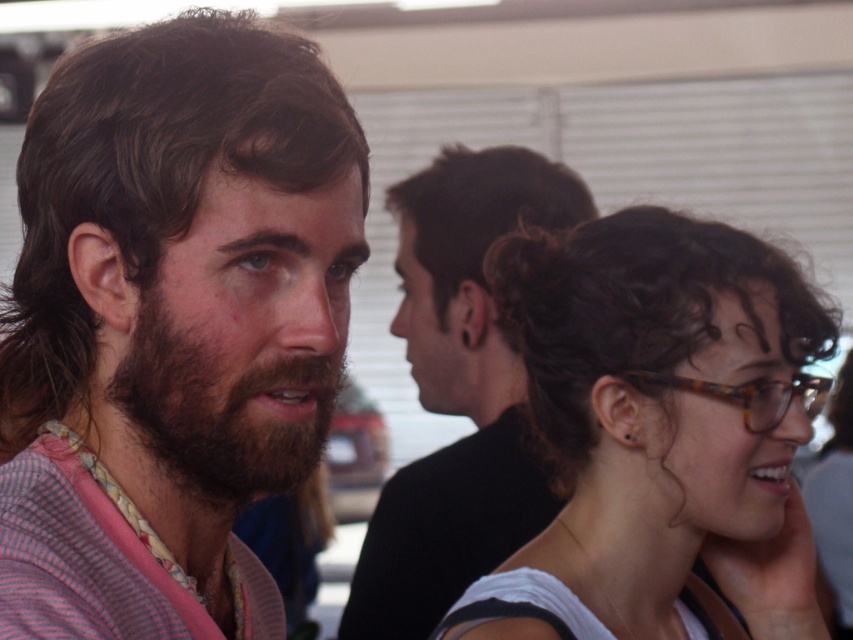
You are a photographer trying to capture a candid shot of the two people in the foreground. You need to ensure there is enough space between the striped fabric shirt at left and the brown hair at center for your camera lens to focus properly. The minimum focusing distance for your lens is 30 centimeters. Can you take the photo without moving either subject?

The striped fabric shirt at left is 35.35 centimeters from the brown hair at center, which is greater than the minimum focusing distance of 30 centimeters. Therefore, you can take the photo without moving either subject.

You are a photographer setting up for a group photo. You need to position yourself so that you can capture both the striped fabric shirt at left and the dark brown hair at center in the same frame. Based on the scene description, how far apart are these two subjects?

The striped fabric shirt at left and the dark brown hair at center are 3.55 feet apart.